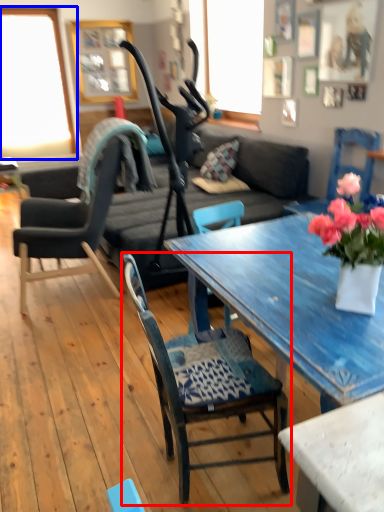
Question: Which object appears farthest to the camera in this image, chair (highlighted by a red box) or window (highlighted by a blue box)?

Choices:
 (A) chair
 (B) window

Answer: (B)